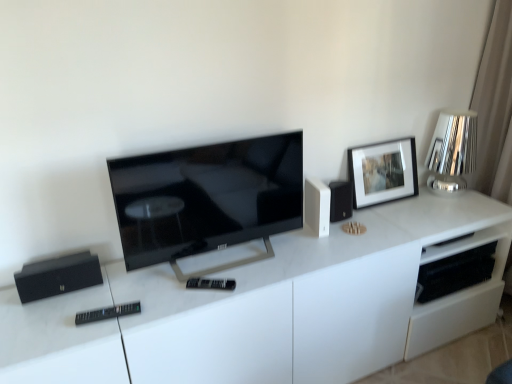
At what (x,y) coordinates should I click in order to perform the action: click on vacant space in between black plastic remote at lower left, marked as the 1th remote in a bottom-to-top arrangement, and matte black tv at center. Please return your answer as a coordinate pair (x, y). This screenshot has width=512, height=384. Looking at the image, I should click on (160, 296).